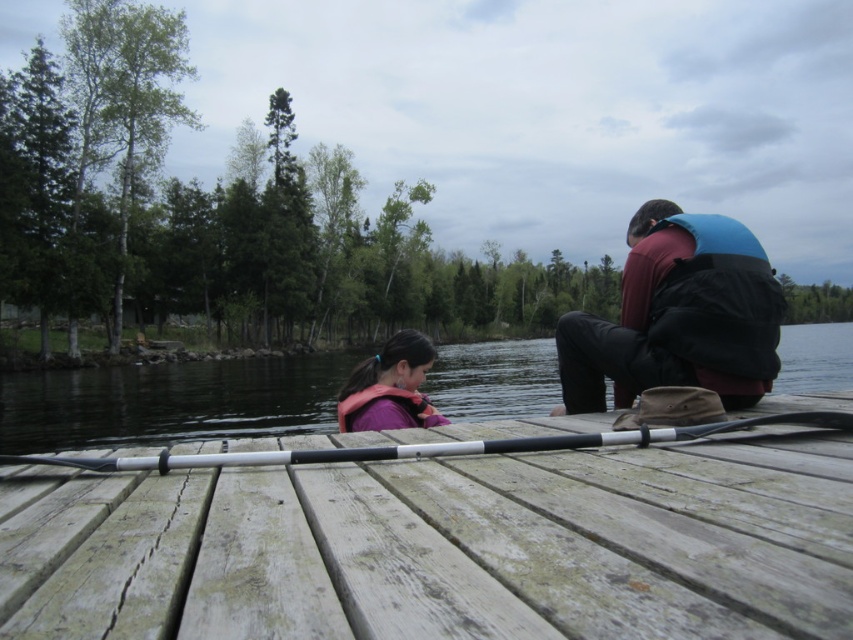
Between point (737, 240) and point (405, 384), which one is positioned behind?

The point (405, 384) is behind.

Between blue matte life vest at right and purple life vest at center, which one has less height?

Standing shorter between the two is purple life vest at center.

Find the location of a particular element. Image resolution: width=853 pixels, height=640 pixels. blue matte life vest at right is located at coordinates (677, 316).

Where is `blue matte life vest at right`? This screenshot has height=640, width=853. blue matte life vest at right is located at coordinates (677, 316).

Is the position of black rubber paddle at center more distant than that of purple life vest at center?

No.

Locate an element on the screen. This screenshot has width=853, height=640. black rubber paddle at center is located at coordinates (437, 445).

Who is more distant from viewer, (383, 458) or (352, 419)?

Point (352, 419)

Where is `black rubber paddle at center`? black rubber paddle at center is located at coordinates (437, 445).

Which is more to the right, transparent water at dock center or purple life vest at center?

transparent water at dock center

Who is higher up, transparent water at dock center or purple life vest at center?

transparent water at dock center is higher up.

Who is more forward, (828,339) or (352,410)?

Point (352,410) is in front.

Where is `transparent water at dock center`? transparent water at dock center is located at coordinates (170, 403).